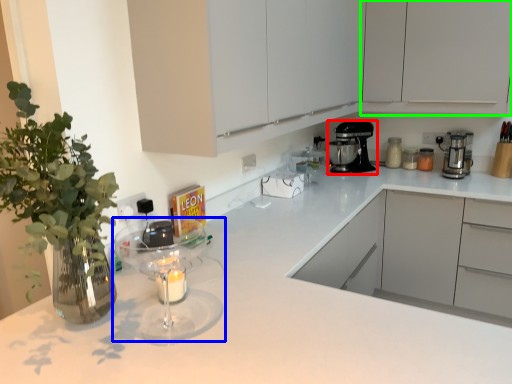
Question: Which object is the closest to the kitchen appliance (highlighted by a red box)? Choose among these: mixer (highlighted by a blue box) or cabinetry (highlighted by a green box).

Choices:
 (A) mixer
 (B) cabinetry

Answer: (B)